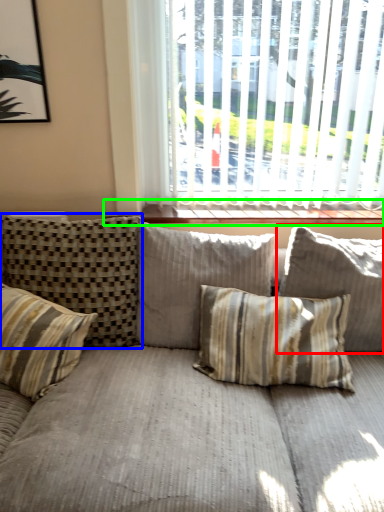
Question: Which object is the farthest from pillow (highlighted by a red box)? Choose among these: pillow (highlighted by a blue box) or window sill (highlighted by a green box).

Choices:
 (A) pillow
 (B) window sill

Answer: (A)